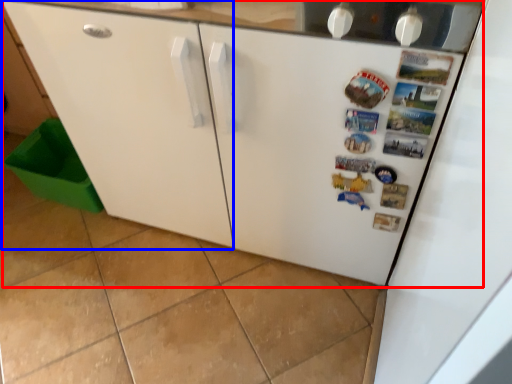
Question: Which point is further to the camera, refrigerator (highlighted by a red box) or cabinetry (highlighted by a blue box)?

Choices:
 (A) refrigerator
 (B) cabinetry

Answer: (A)